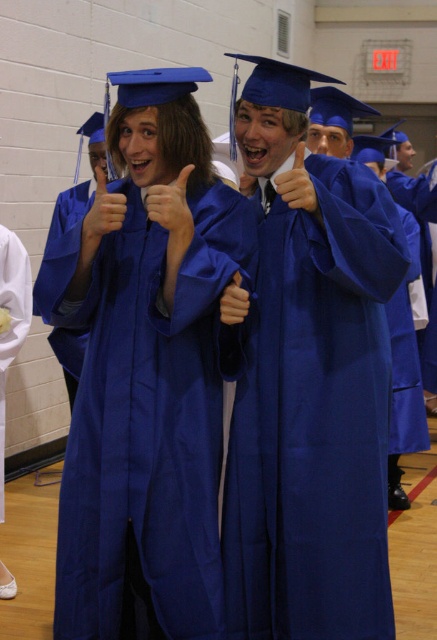
Question: Which point is closer to the camera?

Choices:
 (A) (97, 192)
 (B) (28, 296)
 (C) (249, 563)

Answer: (A)

Question: Does blue satin gown at center lie behind blue satin gown at left?

Choices:
 (A) yes
 (B) no

Answer: (B)

Question: Is matte blue gown at center further to the viewer compared to blue satin gown at left?

Choices:
 (A) no
 (B) yes

Answer: (A)

Question: Can you confirm if matte blue gown at center is thinner than matte blue thumb at upper center?

Choices:
 (A) no
 (B) yes

Answer: (A)

Question: Which point appears closest to the camera in this image?

Choices:
 (A) (9, 244)
 (B) (351, 172)

Answer: (B)

Question: Which point is farther from the camera taking this photo?

Choices:
 (A) (0, 403)
 (B) (260, 598)
 (C) (134, 280)
 (D) (97, 211)

Answer: (A)